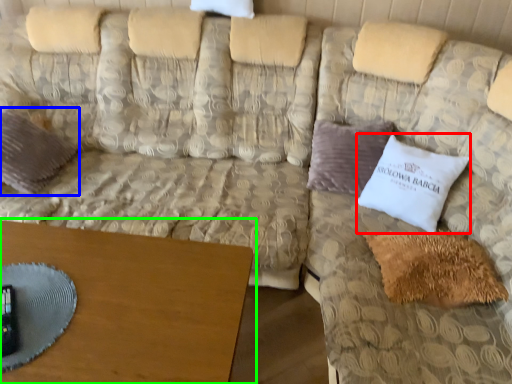
Question: Which object is the farthest from pillow (highlighted by a red box)? Choose among these: pillow (highlighted by a blue box) or table (highlighted by a green box).

Choices:
 (A) pillow
 (B) table

Answer: (A)